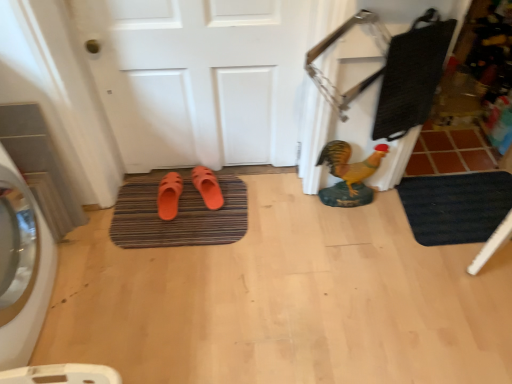
The image size is (512, 384). What are the coordinates of `vacant area that is situated to the right of orange rubber slipper at center, placed as the 1th footwear when sorted from right to left` in the screenshot? It's located at (233, 195).